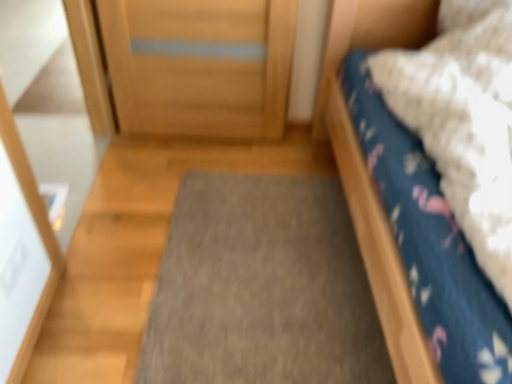
Question: Does blue cotton bed at right have a lesser width compared to gray carpet at center?

Choices:
 (A) no
 (B) yes

Answer: (A)

Question: Is blue cotton bed at right far away from gray carpet at center?

Choices:
 (A) no
 (B) yes

Answer: (A)

Question: Is gray carpet at center at the back of blue cotton bed at right?

Choices:
 (A) no
 (B) yes

Answer: (A)

Question: From a real-world perspective, is blue cotton bed at right physically above gray carpet at center?

Choices:
 (A) no
 (B) yes

Answer: (B)

Question: Is blue cotton bed at right not within gray carpet at center?

Choices:
 (A) no
 (B) yes

Answer: (B)

Question: Does blue cotton bed at right lie in front of gray carpet at center?

Choices:
 (A) no
 (B) yes

Answer: (B)

Question: Is gray carpet at center placed right next to blue cotton bed at right?

Choices:
 (A) no
 (B) yes

Answer: (A)

Question: Is gray carpet at center at the left side of blue cotton bed at right?

Choices:
 (A) no
 (B) yes

Answer: (B)

Question: Does gray carpet at center have a larger size compared to blue cotton bed at right?

Choices:
 (A) yes
 (B) no

Answer: (B)

Question: From a real-world perspective, is gray carpet at center located beneath blue cotton bed at right?

Choices:
 (A) yes
 (B) no

Answer: (A)

Question: Can blue cotton bed at right be found inside gray carpet at center?

Choices:
 (A) yes
 (B) no

Answer: (B)

Question: Can you confirm if gray carpet at center is shorter than blue cotton bed at right?

Choices:
 (A) no
 (B) yes

Answer: (B)

Question: In terms of height, does gray carpet at center look taller or shorter compared to blue cotton bed at right?

Choices:
 (A) tall
 (B) short

Answer: (B)